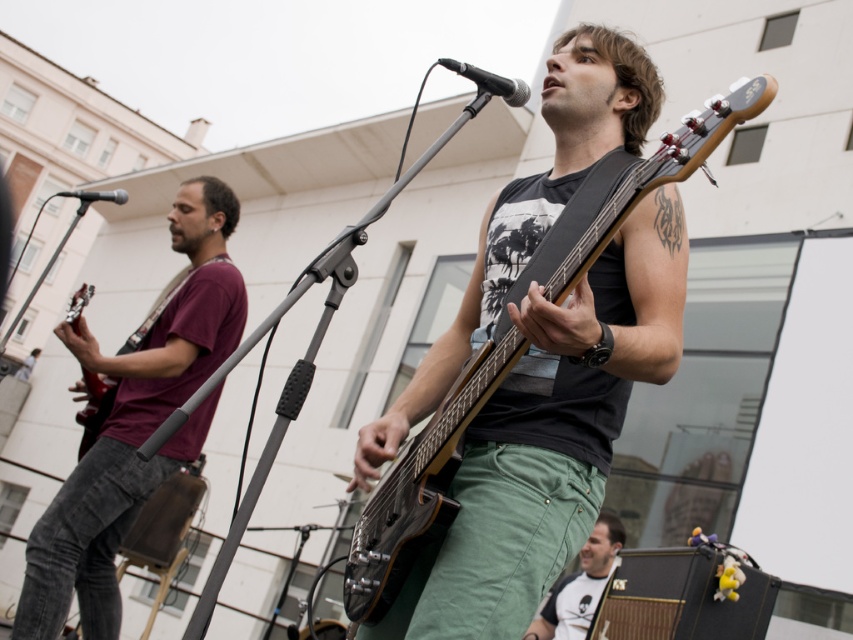
Consider the image. Is maroon cotton shirt at left wider than matte black guitar at center?

Yes.

Can you confirm if maroon cotton shirt at left is bigger than matte black guitar at center?

Yes.

Locate an element on the screen. The image size is (853, 640). maroon cotton shirt at left is located at coordinates (135, 424).

Who is positioned more to the left, matte black guitar at center or white t-shirt at lower right?

From the viewer's perspective, matte black guitar at center appears more on the left side.

Which of these two, matte black guitar at center or white t-shirt at lower right, stands shorter?

white t-shirt at lower right

At what (x,y) coordinates should I click in order to perform the action: click on matte black guitar at center. Please return your answer as a coordinate pair (x, y). Looking at the image, I should click on (515, 349).

Does maroon cotton shirt at left have a smaller size compared to white t-shirt at lower right?

Incorrect, maroon cotton shirt at left is not smaller in size than white t-shirt at lower right.

Which is more to the right, maroon cotton shirt at left or white t-shirt at lower right?

white t-shirt at lower right

Which is behind, point (173, 224) or point (573, 620)?

Point (573, 620)

Identify the location of maroon cotton shirt at left. (135, 424).